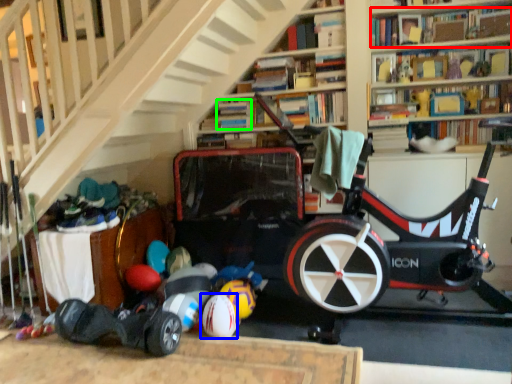
Question: Based on their relative distances, which object is nearer to book (highlighted by a red box)? Choose from ball (highlighted by a blue box) and book (highlighted by a green box).

Choices:
 (A) ball
 (B) book

Answer: (B)